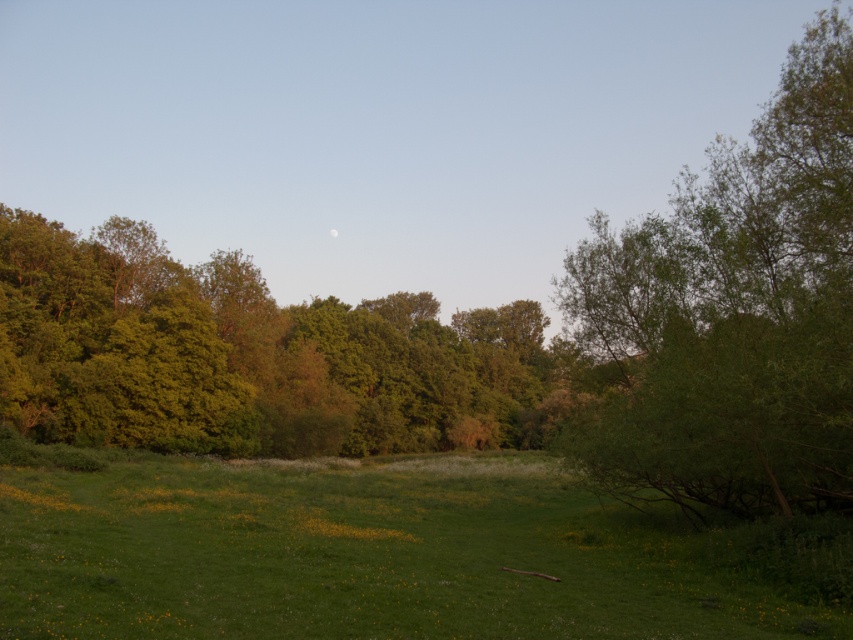
Question: Which object is the farthest from the green leafy tree at center?

Choices:
 (A) green leafy tree at right
 (B) green grassy field at center

Answer: (A)

Question: Which point appears closest to the camera in this image?

Choices:
 (A) (846, 458)
 (B) (451, 518)
 (C) (466, 371)

Answer: (A)

Question: Can you confirm if green grassy field at center is positioned below green leafy tree at right?

Choices:
 (A) no
 (B) yes

Answer: (B)

Question: Can you confirm if green grassy field at center is bigger than green leafy tree at center?

Choices:
 (A) no
 (B) yes

Answer: (A)

Question: Does green leafy tree at right have a larger size compared to green leafy tree at center?

Choices:
 (A) no
 (B) yes

Answer: (B)

Question: Among these points, which one is farthest from the camera?

Choices:
 (A) (552, 604)
 (B) (418, 374)
 (C) (838, 301)

Answer: (B)